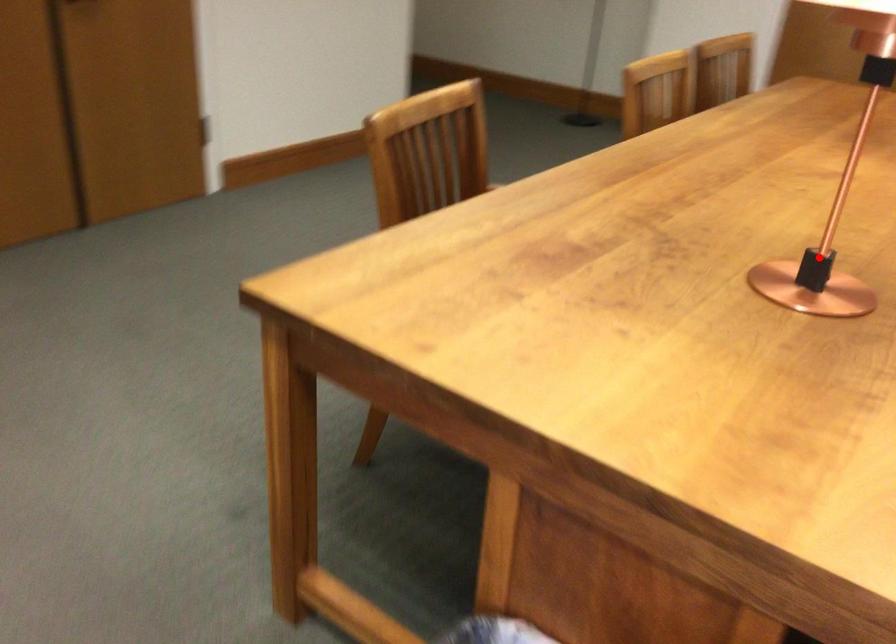
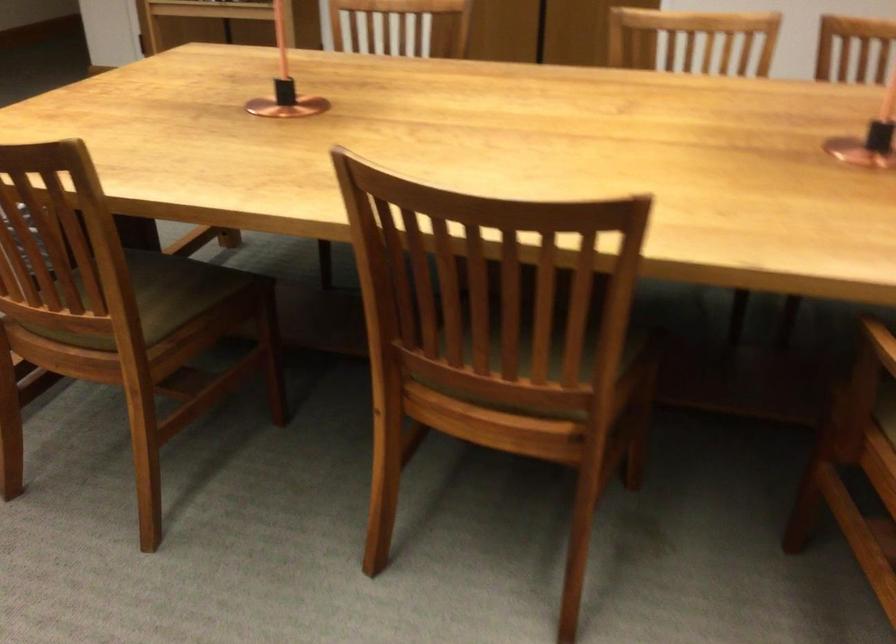
Locate, in the second image, the point that corresponds to the highlighted location in the first image.

(285, 84)